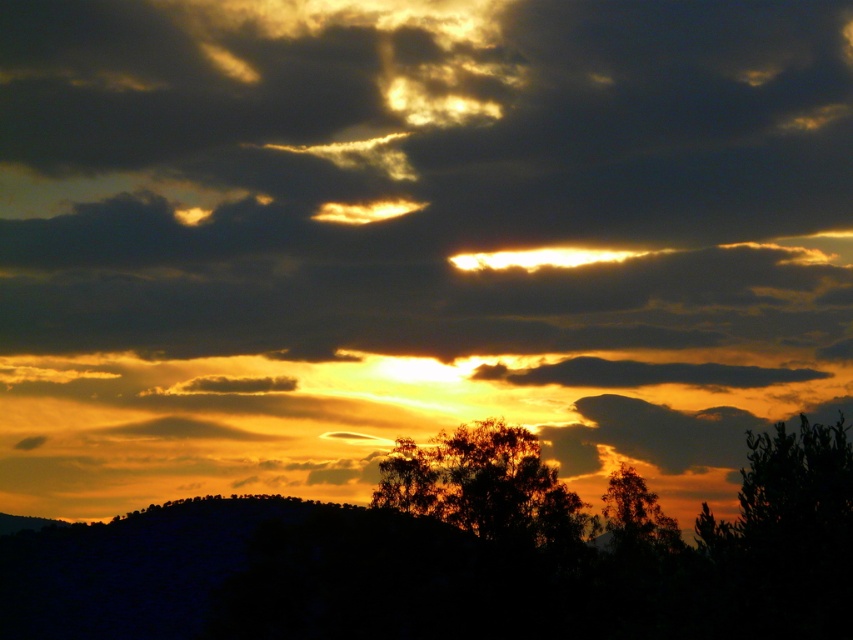
Question: Which object is the farthest from the dark green leafy tree at lower right?

Choices:
 (A) silhouetted foliage at center
 (B) dark green leafy tree at right

Answer: (A)

Question: Which of the following is the closest to the observer?

Choices:
 (A) [521, 509]
 (B) [831, 547]
 (C) [647, 492]

Answer: (B)

Question: Which of the following is the farthest from the observer?

Choices:
 (A) (622, 536)
 (B) (830, 568)

Answer: (A)

Question: Where is silhouetted foliage at center located in relation to dark green leafy tree at right in the image?

Choices:
 (A) above
 (B) below

Answer: (A)

Question: Is silhouetted foliage at center behind dark green leafy tree at right?

Choices:
 (A) no
 (B) yes

Answer: (A)

Question: Can you confirm if dark green leafy tree at lower right is thinner than dark green leafy tree at right?

Choices:
 (A) yes
 (B) no

Answer: (B)